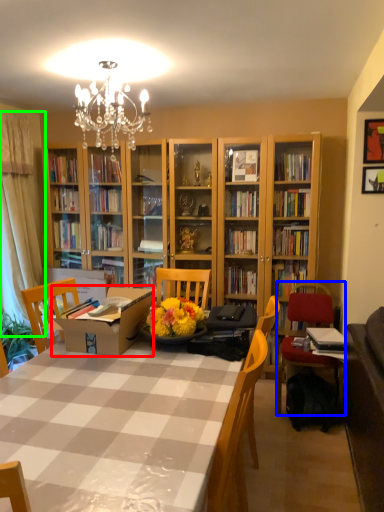
Question: Which is nearer to the cardboard box (highlighted by a red box)? chair (highlighted by a blue box) or curtain (highlighted by a green box).

Choices:
 (A) chair
 (B) curtain

Answer: (A)